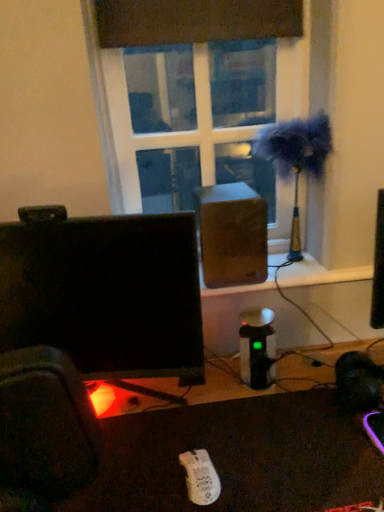
From the picture: In order to face black plastic desk at lower center, should I rotate leftwards or rightwards?

Turn left by 0.684 degrees to look at black plastic desk at lower center.

Image resolution: width=384 pixels, height=512 pixels. What do you see at coordinates (105, 293) in the screenshot?
I see `black glossy monitor at center` at bounding box center [105, 293].

This screenshot has height=512, width=384. Describe the element at coordinates (200, 477) in the screenshot. I see `white matte wii controller at lower center` at that location.

Find the location of `transparent glass window at center`. transparent glass window at center is located at coordinates (156, 111).

What is the approximate width of wooden speaker at center?

wooden speaker at center is 2.11 inches in width.

Locate an element on the screen. This screenshot has width=384, height=512. black plastic desk at lower center is located at coordinates (236, 457).

Is wooden speaker at center placed right next to white matte wii controller at lower center?

No, wooden speaker at center is not in contact with white matte wii controller at lower center.

Is wooden speaker at center to the right of white matte wii controller at lower center from the viewer's perspective?

Yes, wooden speaker at center is to the right of white matte wii controller at lower center.

Is wooden speaker at center facing away from white matte wii controller at lower center?

No, wooden speaker at center is not facing the opposite direction of white matte wii controller at lower center.

Is wooden speaker at center behind white matte wii controller at lower center?

That is True.

Is metallic gold table lamp at upper right touching white matte wii controller at lower center?

metallic gold table lamp at upper right is not next to white matte wii controller at lower center, and they're not touching.

Which is correct: metallic gold table lamp at upper right is inside white matte wii controller at lower center, or outside of it?

metallic gold table lamp at upper right is spatially situated outside white matte wii controller at lower center.

Is metallic gold table lamp at upper right at the right side of white matte wii controller at lower center?

Yes.

How much distance is there between metallic gold table lamp at upper right and white matte wii controller at lower center?

A distance of 30.88 inches exists between metallic gold table lamp at upper right and white matte wii controller at lower center.

From the image's perspective, which one is positioned higher, black glossy monitor at center or transparent glass window at center?

From the image's view, transparent glass window at center is above.

Is black glossy monitor at center to the right of transparent glass window at center from the viewer's perspective?

Incorrect, black glossy monitor at center is not on the right side of transparent glass window at center.

In the scene shown: From a real-world perspective, relative to transparent glass window at center, is black glossy monitor at center vertically above or below?

Clearly, from a real-world perspective, black glossy monitor at center is below transparent glass window at center.

Consider the image. Is black glossy monitor at center positioned with its back to transparent glass window at center?

Yes, black glossy monitor at center is positioned with its back facing transparent glass window at center.

Where is `speaker to the right of transparent glass window at center`? Image resolution: width=384 pixels, height=512 pixels. speaker to the right of transparent glass window at center is located at coordinates (231, 234).

Is transparent glass window at center located within wooden speaker at center?

Definitely not — transparent glass window at center is not inside wooden speaker at center.

Are wooden speaker at center and transparent glass window at center located far from each other?

wooden speaker at center is near transparent glass window at center, not far away.

Can you confirm if wooden speaker at center is positioned to the left of transparent glass window at center?

No, wooden speaker at center is not to the left of transparent glass window at center.

Could transparent glass window at center be considered to be inside metallic gold table lamp at upper right?

No, transparent glass window at center is not a part of metallic gold table lamp at upper right.

From the image's perspective, is metallic gold table lamp at upper right below transparent glass window at center?

Correct, metallic gold table lamp at upper right appears lower than transparent glass window at center in the image.

From a real-world perspective, is metallic gold table lamp at upper right on transparent glass window at center?

No, from a real-world perspective, metallic gold table lamp at upper right is not on top of transparent glass window at center.

From the image's perspective, relative to black glossy monitor at center, is wooden speaker at center above or below?

Clearly, from the image's perspective, wooden speaker at center is above black glossy monitor at center.

Is wooden speaker at center wider or thinner than black glossy monitor at center?

wooden speaker at center is thinner than black glossy monitor at center.

Does wooden speaker at center appear on the left side of black glossy monitor at center?

No, wooden speaker at center is not to the left of black glossy monitor at center.

From a real-world perspective, is wooden speaker at center physically located above or below black glossy monitor at center?

wooden speaker at center is above black glossy monitor at center.

The width and height of the screenshot is (384, 512). In order to click on Wii controller lying below the black plastic desk at lower center (from the image's perspective) in this screenshot , I will do `click(200, 477)`.

Choose the correct answer: Is white matte wii controller at lower center inside black plastic desk at lower center or outside it?

white matte wii controller at lower center is inside black plastic desk at lower center.

Can you tell me how much white matte wii controller at lower center and black plastic desk at lower center differ in facing direction?

There is a 3.8-degree angle between the facing directions of white matte wii controller at lower center and black plastic desk at lower center.

Locate an element on the screen. speaker above the white matte wii controller at lower center (from a real-world perspective) is located at coordinates (231, 234).

At what (x,y) coordinates should I click in order to perform the action: click on Wii controller in front of the metallic gold table lamp at upper right. Please return your answer as a coordinate pair (x, y). Image resolution: width=384 pixels, height=512 pixels. Looking at the image, I should click on (200, 477).

Looking at the image, which one is located further to white matte wii controller at lower center, black glossy monitor at center or wooden speaker at center?

The object further to white matte wii controller at lower center is wooden speaker at center.

Estimate the real-world distances between objects in this image. Which object is closer to white matte wii controller at lower center, black plastic desk at lower center or wooden speaker at center?

black plastic desk at lower center is positioned closer to the anchor white matte wii controller at lower center.

Estimate the real-world distances between objects in this image. Which object is closer to black glossy monitor at center, transparent glass window at center or wooden speaker at center?

Based on the image, wooden speaker at center appears to be nearer to black glossy monitor at center.

Estimate the real-world distances between objects in this image. Which object is further from black plastic desk at lower center, metallic gold table lamp at upper right or transparent glass window at center?

Based on the image, transparent glass window at center appears to be further to black plastic desk at lower center.

Based on their spatial positions, is black glossy monitor at center or metallic gold table lamp at upper right further from black plastic desk at lower center?

metallic gold table lamp at upper right is positioned further to the anchor black plastic desk at lower center.

Looking at the image, which one is located further to transparent glass window at center, black glossy monitor at center or white matte wii controller at lower center?

white matte wii controller at lower center.

Estimate the real-world distances between objects in this image. Which object is further from white matte wii controller at lower center, black plastic desk at lower center or black glossy monitor at center?

black glossy monitor at center is further to white matte wii controller at lower center.

When comparing their distances from transparent glass window at center, does wooden speaker at center or black plastic desk at lower center seem closer?

Based on the image, wooden speaker at center appears to be nearer to transparent glass window at center.

The image size is (384, 512). Find the location of `table lamp between transparent glass window at center and black plastic desk at lower center from top to bottom`. table lamp between transparent glass window at center and black plastic desk at lower center from top to bottom is located at coordinates (296, 158).

The width and height of the screenshot is (384, 512). I want to click on computer monitor between metallic gold table lamp at upper right and white matte wii controller at lower center from top to bottom, so click(105, 293).

At what (x,y) coordinates should I click in order to perform the action: click on desk between wooden speaker at center and white matte wii controller at lower center from top to bottom. Please return your answer as a coordinate pair (x, y). Looking at the image, I should click on (236, 457).

At what (x,y) coordinates should I click in order to perform the action: click on computer monitor between wooden speaker at center and black plastic desk at lower center in the vertical direction. Please return your answer as a coordinate pair (x, y). The width and height of the screenshot is (384, 512). Looking at the image, I should click on (105, 293).